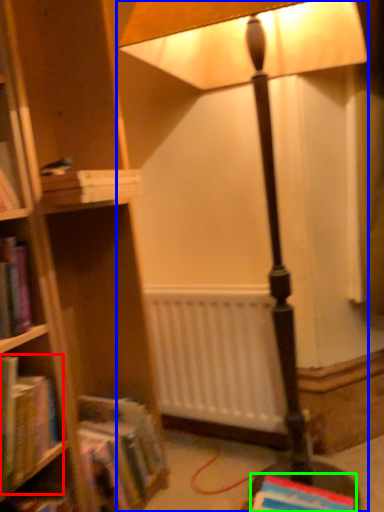
Question: Considering the real-world distances, which object is farthest from book (highlighted by a red box)? lamp (highlighted by a blue box) or book (highlighted by a green box)?

Choices:
 (A) lamp
 (B) book

Answer: (A)